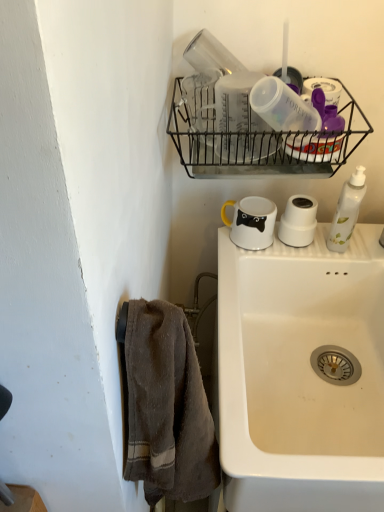
Find the location of a particular element. This screenshot has height=512, width=384. vacant space to the right of white plastic soap dispenser at right is located at coordinates (366, 240).